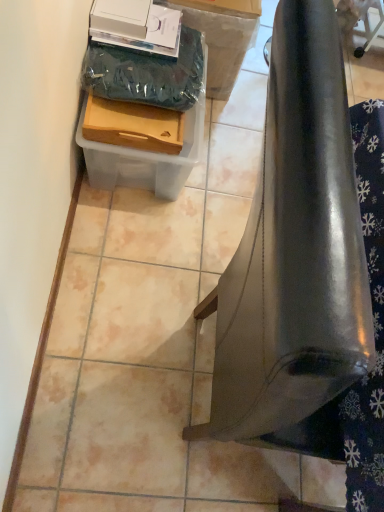
Measure the distance between clear plastic container at lower left, arranged as the first box when viewed from the back, and camera.

The depth of clear plastic container at lower left, arranged as the first box when viewed from the back, is 1.27 meters.

Image resolution: width=384 pixels, height=512 pixels. Identify the location of wooden tray at lower left, the 2th box viewed from the back. (133, 125).

At what (x,y) coordinates should I click in order to perform the action: click on clear plastic container at lower left, placed as the 2th box when sorted from front to back. Please return your answer as a coordinate pair (x, y). The width and height of the screenshot is (384, 512). Looking at the image, I should click on (144, 95).

Locate an element on the screen. box in front of the clear plastic container at lower left, placed as the 2th box when sorted from front to back is located at coordinates (133, 125).

From a real-world perspective, is wooden tray at lower left, the 2th box viewed from the back, below clear plastic container at lower left, placed as the 2th box when sorted from front to back?

No.

Considering the relative sizes of wooden tray at lower left, the 2th box viewed from the back, and clear plastic container at lower left, arranged as the first box when viewed from the back, in the image provided, is wooden tray at lower left, the 2th box viewed from the back, wider than clear plastic container at lower left, arranged as the first box when viewed from the back,?

Incorrect, the width of wooden tray at lower left, the 2th box viewed from the back, does not surpass that of clear plastic container at lower left, arranged as the first box when viewed from the back.

Is wooden tray at lower left, the first box in the front-to-back sequence, taller or shorter than clear plastic container at lower left, arranged as the first box when viewed from the back?

Clearly, wooden tray at lower left, the first box in the front-to-back sequence, is shorter compared to clear plastic container at lower left, arranged as the first box when viewed from the back.

Looking at their sizes, would you say wooden tray at lower left, the 2th box viewed from the back, is wider or thinner than glossy metallic bell at lower right?

Considering their sizes, wooden tray at lower left, the 2th box viewed from the back, looks slimmer than glossy metallic bell at lower right.

How distant is wooden tray at lower left, the first box in the front-to-back sequence, from glossy metallic bell at lower right?

They are 28.37 inches apart.

From a real-world perspective, is wooden tray at lower left, the 2th box viewed from the back, positioned over glossy metallic bell at lower right based on gravity?

No.

Is wooden tray at lower left, the first box in the front-to-back sequence, spatially inside glossy metallic bell at lower right, or outside of it?

The correct answer is: outside.

Which of these two, glossy metallic bell at lower right or wooden tray at lower left, the 2th box viewed from the back, is smaller?

Smaller between the two is wooden tray at lower left, the 2th box viewed from the back.

Is wooden tray at lower left, the 2th box viewed from the back, inside glossy metallic bell at lower right?

No.

Is glossy metallic bell at lower right further to the viewer compared to wooden tray at lower left, the first box in the front-to-back sequence?

No.

From the image's perspective, is glossy metallic bell at lower right above wooden tray at lower left, the 2th box viewed from the back?

No.

Consider the image. Who is shorter, glossy metallic bell at lower right or clear plastic container at lower left, arranged as the first box when viewed from the back?

clear plastic container at lower left, arranged as the first box when viewed from the back.

From the picture: Is glossy metallic bell at lower right closer to camera compared to clear plastic container at lower left, arranged as the first box when viewed from the back?

That is True.

Does glossy metallic bell at lower right touch clear plastic container at lower left, placed as the 2th box when sorted from front to back?

No, glossy metallic bell at lower right is not next to clear plastic container at lower left, placed as the 2th box when sorted from front to back.

What's the angular difference between glossy metallic bell at lower right and clear plastic container at lower left, arranged as the first box when viewed from the back,'s facing directions?

glossy metallic bell at lower right and clear plastic container at lower left, arranged as the first box when viewed from the back, are facing 0.629 degrees away from each other.

From a real-world perspective, is clear plastic container at lower left, placed as the 2th box when sorted from front to back, located higher than wooden tray at lower left, the first box in the front-to-back sequence?

Actually, clear plastic container at lower left, placed as the 2th box when sorted from front to back, is physically below wooden tray at lower left, the first box in the front-to-back sequence, in the real world.

From the image's perspective, is clear plastic container at lower left, arranged as the first box when viewed from the back, below wooden tray at lower left, the first box in the front-to-back sequence?

Yes.

Where is `box below the wooden tray at lower left, the 2th box viewed from the back (from a real-world perspective)`? box below the wooden tray at lower left, the 2th box viewed from the back (from a real-world perspective) is located at coordinates (144, 95).

Is clear plastic container at lower left, placed as the 2th box when sorted from front to back, not close to wooden tray at lower left, the first box in the front-to-back sequence?

No, clear plastic container at lower left, placed as the 2th box when sorted from front to back, is in close proximity to wooden tray at lower left, the first box in the front-to-back sequence.

Is the position of clear plastic container at lower left, arranged as the first box when viewed from the back, more distant than that of glossy metallic bell at lower right?

Yes.

Is clear plastic container at lower left, arranged as the first box when viewed from the back, located outside glossy metallic bell at lower right?

clear plastic container at lower left, arranged as the first box when viewed from the back, lies outside glossy metallic bell at lower right's area.

What's the angular difference between clear plastic container at lower left, arranged as the first box when viewed from the back, and glossy metallic bell at lower right's facing directions?

The angle between the facing direction of clear plastic container at lower left, arranged as the first box when viewed from the back, and the facing direction of glossy metallic bell at lower right is 0.629 degrees.

Does point (108, 152) come in front of point (247, 402)?

No, it is behind (247, 402).

In the image, there is a wooden tray at lower left, the first box in the front-to-back sequence. Where is `box below it (from a real-world perspective)`? This screenshot has width=384, height=512. box below it (from a real-world perspective) is located at coordinates (144, 95).

Where is `furniture below the wooden tray at lower left, the first box in the front-to-back sequence (from the image's perspective)`? furniture below the wooden tray at lower left, the first box in the front-to-back sequence (from the image's perspective) is located at coordinates (295, 259).

Estimate the real-world distances between objects in this image. Which object is closer to clear plastic container at lower left, placed as the 2th box when sorted from front to back, wooden tray at lower left, the 2th box viewed from the back, or glossy metallic bell at lower right?

wooden tray at lower left, the 2th box viewed from the back, is positioned closer to the anchor clear plastic container at lower left, placed as the 2th box when sorted from front to back.

Considering their positions, is glossy metallic bell at lower right positioned further to wooden tray at lower left, the 2th box viewed from the back, than clear plastic container at lower left, placed as the 2th box when sorted from front to back?

glossy metallic bell at lower right.

When comparing their distances from glossy metallic bell at lower right, does clear plastic container at lower left, arranged as the first box when viewed from the back, or wooden tray at lower left, the 2th box viewed from the back, seem further?

Among the two, clear plastic container at lower left, arranged as the first box when viewed from the back, is located further to glossy metallic bell at lower right.

Which object lies further to the anchor point glossy metallic bell at lower right, wooden tray at lower left, the first box in the front-to-back sequence, or clear plastic container at lower left, arranged as the first box when viewed from the back?

clear plastic container at lower left, arranged as the first box when viewed from the back, is positioned further to the anchor glossy metallic bell at lower right.

Looking at the image, which one is located closer to wooden tray at lower left, the first box in the front-to-back sequence, clear plastic container at lower left, arranged as the first box when viewed from the back, or glossy metallic bell at lower right?

clear plastic container at lower left, arranged as the first box when viewed from the back.

From the image, which object appears to be nearer to clear plastic container at lower left, placed as the 2th box when sorted from front to back, glossy metallic bell at lower right or wooden tray at lower left, the 2th box viewed from the back?

Among the two, wooden tray at lower left, the 2th box viewed from the back, is located nearer to clear plastic container at lower left, placed as the 2th box when sorted from front to back.

Identify the location of box located between glossy metallic bell at lower right and clear plastic container at lower left, arranged as the first box when viewed from the back, in the depth direction. The height and width of the screenshot is (512, 384). (133, 125).